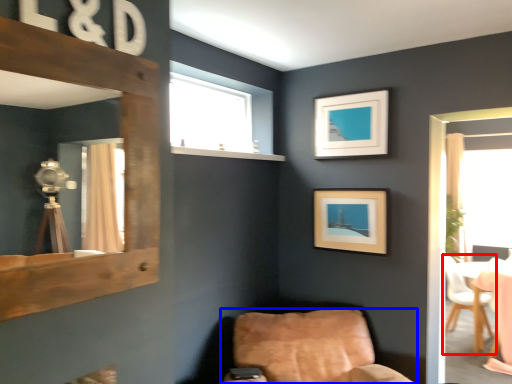
Question: Among these objects, which one is farthest to the camera, chair (highlighted by a red box) or chair (highlighted by a blue box)?

Choices:
 (A) chair
 (B) chair

Answer: (A)